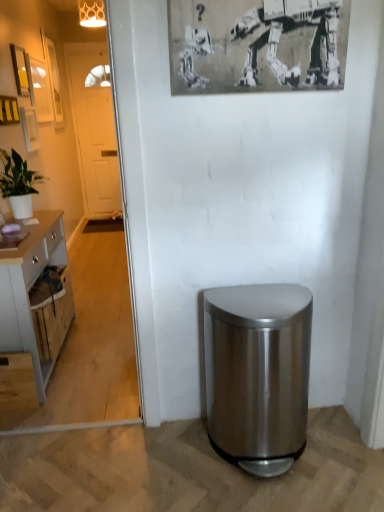
Where is `metallic glass lampshade at upper center`? The image size is (384, 512). metallic glass lampshade at upper center is located at coordinates (91, 13).

The height and width of the screenshot is (512, 384). I want to click on white wooden door at left, so click(94, 127).

What is the approximate height of matte white picture frame at upper left, the 2th picture frame when ordered from back to front?

matte white picture frame at upper left, the 2th picture frame when ordered from back to front, is 53.11 centimeters in height.

What do you see at coordinates (257, 45) in the screenshot?
I see `black and white paper at upper center, the first picture frame in the front-to-back sequence` at bounding box center [257, 45].

The image size is (384, 512). What are the coordinates of `black and white paper at upper center, the 6th picture frame in the left-to-right sequence` in the screenshot? It's located at (257, 45).

Describe the element at coordinates (29, 290) in the screenshot. I see `light gray wood cabinet at left` at that location.

The height and width of the screenshot is (512, 384). I want to click on matte black picture frame at upper left, acting as the 3th picture frame starting from the left, so click(22, 72).

Identify the location of wooden picture frame at upper left, the second picture frame from the right. The width and height of the screenshot is (384, 512). (9, 110).

Who is more distant, metallic glass lampshade at upper center or matte black picture frame at upper left, the third picture frame positioned from the front?

metallic glass lampshade at upper center is behind.

Looking at the image, does metallic glass lampshade at upper center seem bigger or smaller compared to matte black picture frame at upper left, arranged as the 4th picture frame when viewed from the right?

Clearly, metallic glass lampshade at upper center is larger in size than matte black picture frame at upper left, arranged as the 4th picture frame when viewed from the right.

Could you measure the distance between metallic glass lampshade at upper center and matte black picture frame at upper left, acting as the 3th picture frame starting from the left?

metallic glass lampshade at upper center is 1.75 meters away from matte black picture frame at upper left, acting as the 3th picture frame starting from the left.

Does point (98, 24) lie in front of point (17, 55)?

No, (98, 24) is behind (17, 55).

Is light gray wood cabinet at left in contact with matte white picture frame at upper left, arranged as the 5th picture frame when viewed from the right?

light gray wood cabinet at left is not next to matte white picture frame at upper left, arranged as the 5th picture frame when viewed from the right, and they're not touching.

Looking at this image, which of these two, light gray wood cabinet at left or matte white picture frame at upper left, positioned as the 2th picture frame in left-to-right order, is wider?

light gray wood cabinet at left.

Where is `cabinetry in front of the matte white picture frame at upper left, which is counted as the 5th picture frame, starting from the front`? cabinetry in front of the matte white picture frame at upper left, which is counted as the 5th picture frame, starting from the front is located at coordinates (29, 290).

Is light gray wood cabinet at left to the right of matte white picture frame at upper left, arranged as the 5th picture frame when viewed from the right, from the viewer's perspective?

Yes, light gray wood cabinet at left is to the right of matte white picture frame at upper left, arranged as the 5th picture frame when viewed from the right.

Does green matte plant at left have a lesser width compared to matte white picture frame at upper left, the 3th picture frame from the right?

No, green matte plant at left is not thinner than matte white picture frame at upper left, the 3th picture frame from the right.

Considering the sizes of objects green matte plant at left and matte white picture frame at upper left, positioned as the fourth picture frame in front-to-back order, in the image provided, who is smaller, green matte plant at left or matte white picture frame at upper left, positioned as the fourth picture frame in front-to-back order,?

Smaller between the two is matte white picture frame at upper left, positioned as the fourth picture frame in front-to-back order.

Visually, is green matte plant at left positioned to the left or to the right of matte white picture frame at upper left, which is the fourth picture frame from left to right?

From the image, it's evident that green matte plant at left is to the right of matte white picture frame at upper left, which is the fourth picture frame from left to right.

From a real-world perspective, starting from the green matte plant at left, which picture frame is the 1st one vertically above it? Please provide its 2D coordinates.

[(30, 128)]

Considering the positions of objects matte black picture frame at upper left, arranged as the 4th picture frame when viewed from the right, and matte white picture frame at upper left, the 2th picture frame when ordered from back to front, in the image provided, who is more to the right, matte black picture frame at upper left, arranged as the 4th picture frame when viewed from the right, or matte white picture frame at upper left, the 2th picture frame when ordered from back to front,?

matte black picture frame at upper left, arranged as the 4th picture frame when viewed from the right, is more to the right.

Does matte black picture frame at upper left, acting as the 3th picture frame starting from the left, turn towards matte white picture frame at upper left, positioned as the 2th picture frame in left-to-right order?

No, matte black picture frame at upper left, acting as the 3th picture frame starting from the left, is not aimed at matte white picture frame at upper left, positioned as the 2th picture frame in left-to-right order.

What's the angular difference between matte black picture frame at upper left, acting as the 3th picture frame starting from the left, and matte white picture frame at upper left, the 2th picture frame when ordered from back to front,'s facing directions?

0.00101 degrees separate the facing orientations of matte black picture frame at upper left, acting as the 3th picture frame starting from the left, and matte white picture frame at upper left, the 2th picture frame when ordered from back to front.

Would you say matte black picture frame at upper left, acting as the 3th picture frame starting from the left, contains matte white picture frame at upper left, arranged as the 5th picture frame when viewed from the right?

No, matte black picture frame at upper left, acting as the 3th picture frame starting from the left, does not contain matte white picture frame at upper left, arranged as the 5th picture frame when viewed from the right.

Could you tell me if metallic glass lampshade at upper center is turned towards matte white picture frame at upper left, the 2th picture frame when ordered from back to front?

No, metallic glass lampshade at upper center is not oriented towards matte white picture frame at upper left, the 2th picture frame when ordered from back to front.

Can you confirm if metallic glass lampshade at upper center is smaller than matte white picture frame at upper left, arranged as the 5th picture frame when viewed from the right?

Indeed, metallic glass lampshade at upper center has a smaller size compared to matte white picture frame at upper left, arranged as the 5th picture frame when viewed from the right.

Is metallic glass lampshade at upper center not near matte white picture frame at upper left, positioned as the 2th picture frame in left-to-right order?

Indeed, metallic glass lampshade at upper center is not near matte white picture frame at upper left, positioned as the 2th picture frame in left-to-right order.

From a real-world perspective, is black and white paper at upper center, which is the 1th picture frame from right to left, positioned over wooden picture frame at upper left, the second picture frame when ordered from front to back, based on gravity?

Yes.

Considering the sizes of objects black and white paper at upper center, the first picture frame in the front-to-back sequence, and wooden picture frame at upper left, the fifth picture frame when ordered from left to right, in the image provided, who is thinner, black and white paper at upper center, the first picture frame in the front-to-back sequence, or wooden picture frame at upper left, the fifth picture frame when ordered from left to right,?

wooden picture frame at upper left, the fifth picture frame when ordered from left to right, is thinner.

Between black and white paper at upper center, which is the sixth picture frame in back-to-front order, and wooden picture frame at upper left, the fifth picture frame when ordered from left to right, which one appears on the right side from the viewer's perspective?

black and white paper at upper center, which is the sixth picture frame in back-to-front order.

Does point (322, 27) appear closer or farther from the camera than point (0, 118)?

Point (322, 27) is closer to the camera than point (0, 118).

Who is smaller, black and white paper at upper center, which is the sixth picture frame in back-to-front order, or green matte plant at left?

black and white paper at upper center, which is the sixth picture frame in back-to-front order, is smaller.

This screenshot has height=512, width=384. I want to click on picture frame lying on the right of green matte plant at left, so coord(257,45).

Is black and white paper at upper center, which is the sixth picture frame in back-to-front order, far away from green matte plant at left?

Yes.

Which is less distant, [171,77] or [5,152]?

Point [171,77]

There is a matte black picture frame at upper left, arranged as the 4th picture frame when viewed from the right. At what (x,y) coordinates should I click in order to perform the action: click on lamp above it (from a real-world perspective). Please return your answer as a coordinate pair (x, y). This screenshot has height=512, width=384. Looking at the image, I should click on (x=91, y=13).

In order to click on cabinetry beneath the matte white picture frame at upper left, which is counted as the 5th picture frame, starting from the front (from a real-world perspective) in this screenshot , I will do `click(29, 290)`.

Based on their spatial positions, is light gray wood cabinet at left or green matte plant at left further from matte white picture frame at upper left, the 2th picture frame when ordered from back to front?

light gray wood cabinet at left is further to matte white picture frame at upper left, the 2th picture frame when ordered from back to front.

From the image, which object appears to be farther from white wooden door at left, wooden picture frame at upper left, the second picture frame when ordered from front to back, or matte black picture frame at upper left, placed as the fourth picture frame when sorted from back to front?

wooden picture frame at upper left, the second picture frame when ordered from front to back, is further to white wooden door at left.

From the image, which object appears to be nearer to black and white paper at upper center, the 6th picture frame in the left-to-right sequence, wooden picture frame at upper left, which is the 6th picture frame from front to back, or matte white picture frame at upper left, arranged as the 5th picture frame when viewed from the right?

The object closer to black and white paper at upper center, the 6th picture frame in the left-to-right sequence, is matte white picture frame at upper left, arranged as the 5th picture frame when viewed from the right.

Considering their positions, is green matte plant at left positioned closer to wooden picture frame at upper left, the fifth picture frame when ordered from left to right, than matte white picture frame at upper left, the 3th picture frame from the right?

The object closer to wooden picture frame at upper left, the fifth picture frame when ordered from left to right, is matte white picture frame at upper left, the 3th picture frame from the right.

Which object lies further to the anchor point black and white paper at upper center, which is the sixth picture frame in back-to-front order, stainless steel trash can at lower right or wooden picture frame at upper left, the second picture frame when ordered from front to back?

Based on the image, wooden picture frame at upper left, the second picture frame when ordered from front to back, appears to be further to black and white paper at upper center, which is the sixth picture frame in back-to-front order.

Looking at the image, which one is located further to wooden picture frame at upper left, positioned as the sixth picture frame in right-to-left order, matte white picture frame at upper left, the 3th picture frame from the right, or stainless steel trash can at lower right?

stainless steel trash can at lower right is positioned further to the anchor wooden picture frame at upper left, positioned as the sixth picture frame in right-to-left order.

Considering their positions, is wooden picture frame at upper left, which is the 6th picture frame from front to back, positioned closer to matte white picture frame at upper left, which is counted as the 3th picture frame, starting from the back, than matte white picture frame at upper left, which is counted as the 5th picture frame, starting from the front?

Based on the image, matte white picture frame at upper left, which is counted as the 5th picture frame, starting from the front, appears to be nearer to matte white picture frame at upper left, which is counted as the 3th picture frame, starting from the back.

Looking at the image, which one is located further to metallic glass lampshade at upper center, light gray wood cabinet at left or stainless steel trash can at lower right?

Among the two, stainless steel trash can at lower right is located further to metallic glass lampshade at upper center.

You are a GUI agent. You are given a task and a screenshot of the screen. Output one action in this format:
    pyautogui.click(x=<x>, y=<y>)
    Task: Click on the trash bin/can located between black and white paper at upper center, which is the sixth picture frame in back-to-front order, and matte black picture frame at upper left, the third picture frame positioned from the front, in the depth direction
    
    Given the screenshot: What is the action you would take?
    pyautogui.click(x=258, y=373)

You are a GUI agent. You are given a task and a screenshot of the screen. Output one action in this format:
    pyautogui.click(x=<x>, y=<y>)
    Task: Click on the picture frame between black and white paper at upper center, the first picture frame in the front-to-back sequence, and matte black picture frame at upper left, the third picture frame positioned from the front, from front to back
    This screenshot has height=512, width=384.
    Given the screenshot: What is the action you would take?
    pyautogui.click(x=9, y=110)

You are a GUI agent. You are given a task and a screenshot of the screen. Output one action in this format:
    pyautogui.click(x=<x>, y=<y>)
    Task: Click on the houseplant between wooden picture frame at upper left, the second picture frame from the right, and black and white paper at upper center, the 6th picture frame in the left-to-right sequence, in the horizontal direction
    Image resolution: width=384 pixels, height=512 pixels.
    Given the screenshot: What is the action you would take?
    pyautogui.click(x=18, y=183)

You are a GUI agent. You are given a task and a screenshot of the screen. Output one action in this format:
    pyautogui.click(x=<x>, y=<y>)
    Task: Click on the houseplant between stainless steel trash can at lower right and white wooden door at left from front to back
    
    Given the screenshot: What is the action you would take?
    pyautogui.click(x=18, y=183)